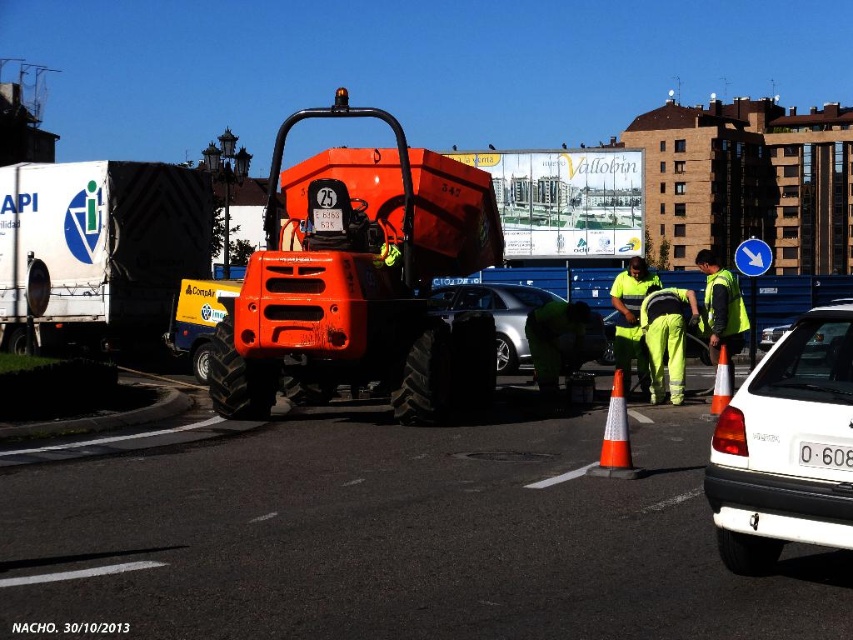
Which is below, white matte car at right or orange plastic traffic cone at right?

orange plastic traffic cone at right is lower down.

Between point (763, 390) and point (727, 401), which one is positioned behind?

Positioned behind is point (727, 401).

Does point (833, 419) come farther from viewer compared to point (727, 385)?

That is False.

Locate an element on the screen. The height and width of the screenshot is (640, 853). white matte car at right is located at coordinates (784, 445).

Can you confirm if orange matte construction vehicle at center is smaller than orange reflective cone at center?

Actually, orange matte construction vehicle at center might be larger than orange reflective cone at center.

Is point (432, 192) positioned after point (624, 422)?

Yes, it is.

Where is `orange matte construction vehicle at center`? This screenshot has width=853, height=640. orange matte construction vehicle at center is located at coordinates (360, 282).

Between white matte truck at left and white glossy car at lower right, which one appears on the right side from the viewer's perspective?

white glossy car at lower right is more to the right.

You are a GUI agent. You are given a task and a screenshot of the screen. Output one action in this format:
    pyautogui.click(x=<x>, y=<y>)
    Task: Click on the white matte truck at left
    Image resolution: width=853 pixels, height=640 pixels.
    Given the screenshot: What is the action you would take?
    pyautogui.click(x=100, y=250)